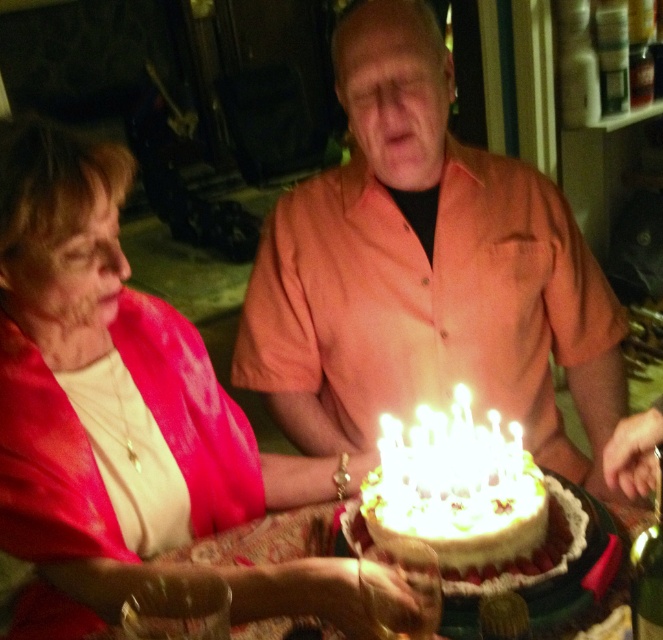
Question: Does orange matte shirt at center have a larger size compared to white wax candles at center?

Choices:
 (A) yes
 (B) no

Answer: (A)

Question: Which object appears farthest from the camera in this image?

Choices:
 (A) matte red blouse at upper left
 (B) white frosted cake at center
 (C) orange matte shirt at center

Answer: (C)

Question: Does matte red blouse at upper left come behind white wax candles at center?

Choices:
 (A) yes
 (B) no

Answer: (B)

Question: Is orange matte shirt at center below white frosted cake at center?

Choices:
 (A) no
 (B) yes

Answer: (A)

Question: Which of these objects is positioned closest to the matte red blouse at upper left?

Choices:
 (A) white wax candles at center
 (B) white frosted cake at center

Answer: (B)

Question: Which point is farther to the camera?

Choices:
 (A) pos(442,88)
 (B) pos(520,474)

Answer: (A)